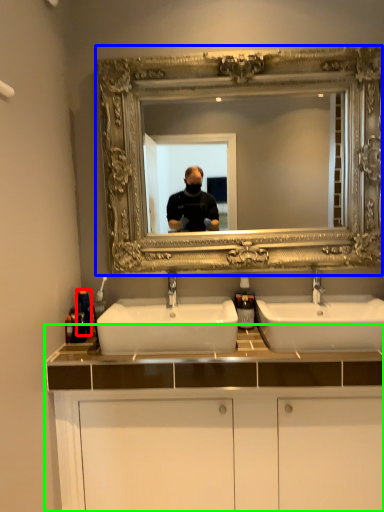
Question: Which object is the closest to the toiletry (highlighted by a red box)? Choose among these: medicine cabinet (highlighted by a blue box) or bathroom cabinet (highlighted by a green box).

Choices:
 (A) medicine cabinet
 (B) bathroom cabinet

Answer: (B)